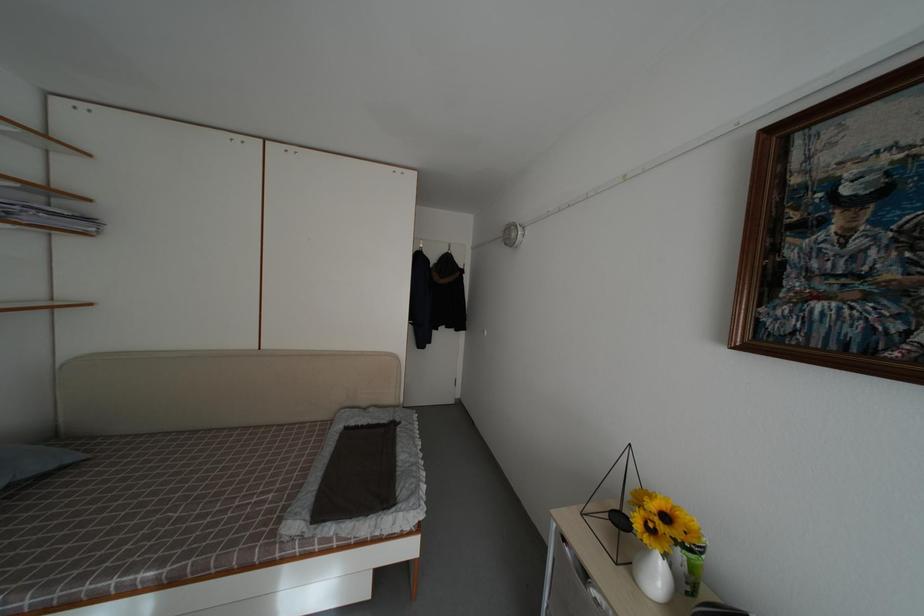
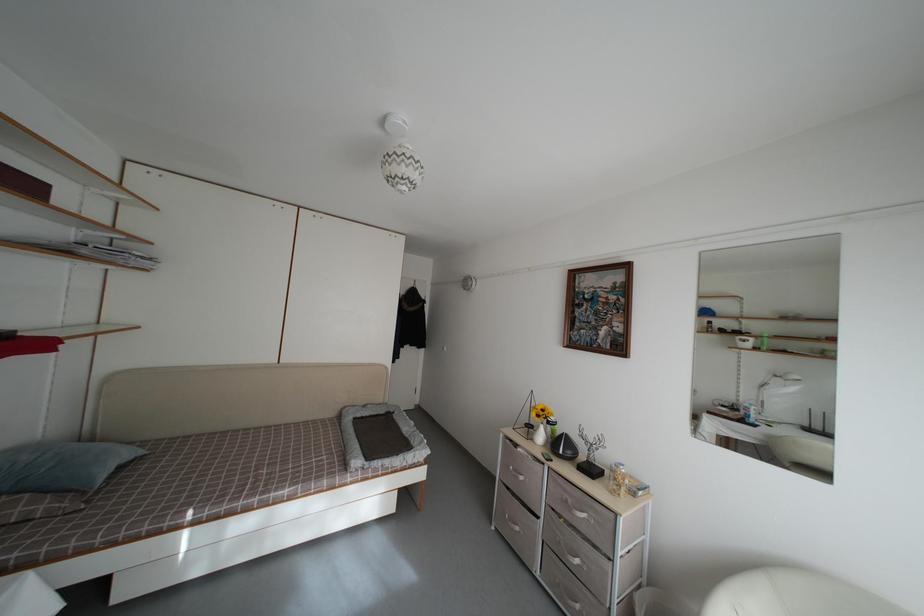
Which direction would the cameraman need to move to produce the second image?

The cameraman moved toward left, backward.